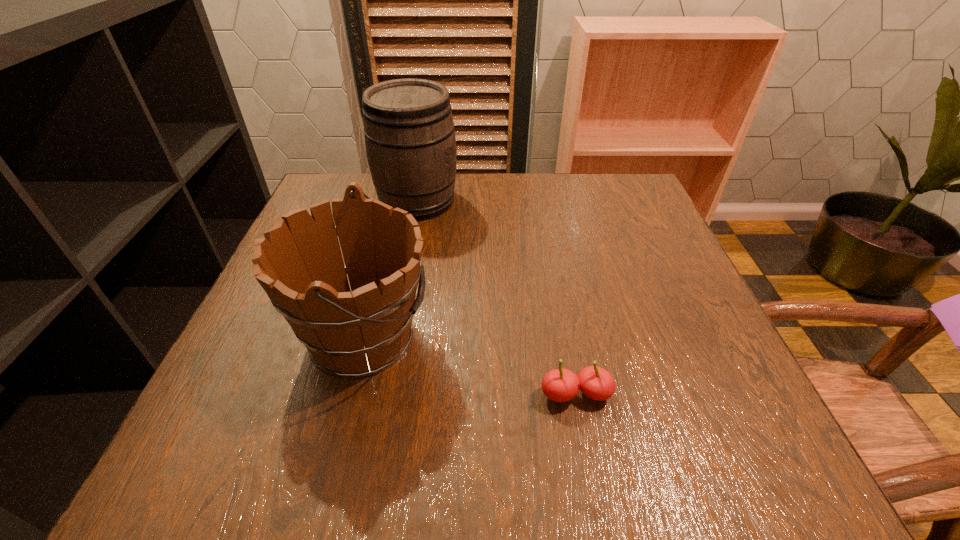
The width and height of the screenshot is (960, 540). Find the location of `vacant space that's between the nearer wine bucket and the rightmost object`. vacant space that's between the nearer wine bucket and the rightmost object is located at coordinates (469, 366).

Locate which object ranks in proximity to the farthest object. Please provide its 2D coordinates. Your answer should be formatted as a tuple, i.e. [(x, y)], where the tuple contains the x and y coordinates of a point satisfying the conditions above.

[(354, 333)]

Point out which object is positioned as the second nearest to the farthest object. Please provide its 2D coordinates. Your answer should be formatted as a tuple, i.e. [(x, y)], where the tuple contains the x and y coordinates of a point satisfying the conditions above.

[(560, 385)]

What are the coordinates of `vacant space that satisfies the following two spatial constraints: 1. on the back side of the shortest object; 2. with the handle on the nearer wine bucket` in the screenshot? It's located at (564, 338).

Locate an element on the screen. Image resolution: width=960 pixels, height=540 pixels. vacant space that satisfies the following two spatial constraints: 1. with the handle on the nearer wine bucket; 2. on the right side of the rightmost object is located at coordinates (349, 394).

In order to click on free space that satisfies the following two spatial constraints: 1. with the handle on the cherry; 2. on the right side of the nearer wine bucket in this screenshot , I will do `click(349, 394)`.